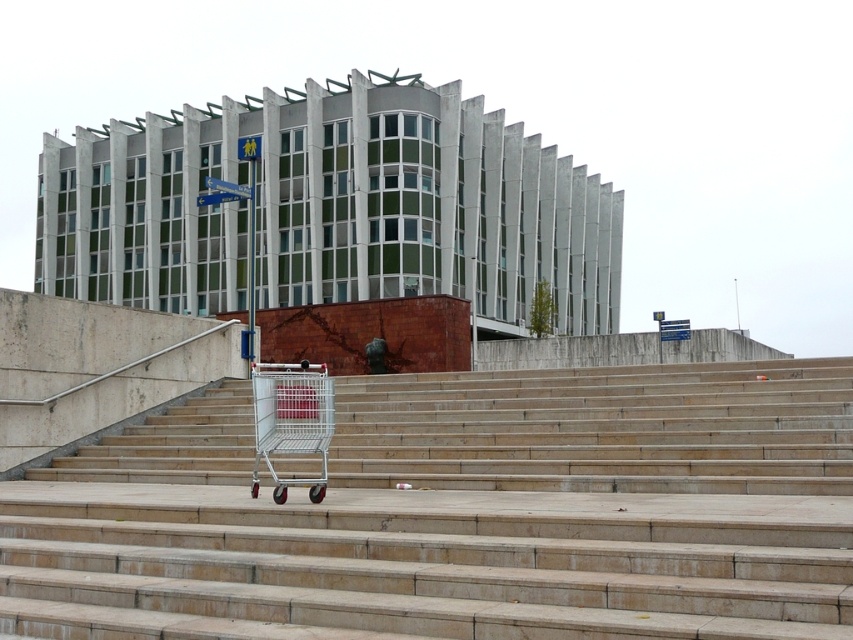
Does smooth concrete stairs at center lie behind silver metallic shopping cart at lower center?

No, smooth concrete stairs at center is in front of silver metallic shopping cart at lower center.

Where is `smooth concrete stairs at center`? The width and height of the screenshot is (853, 640). smooth concrete stairs at center is located at coordinates (461, 513).